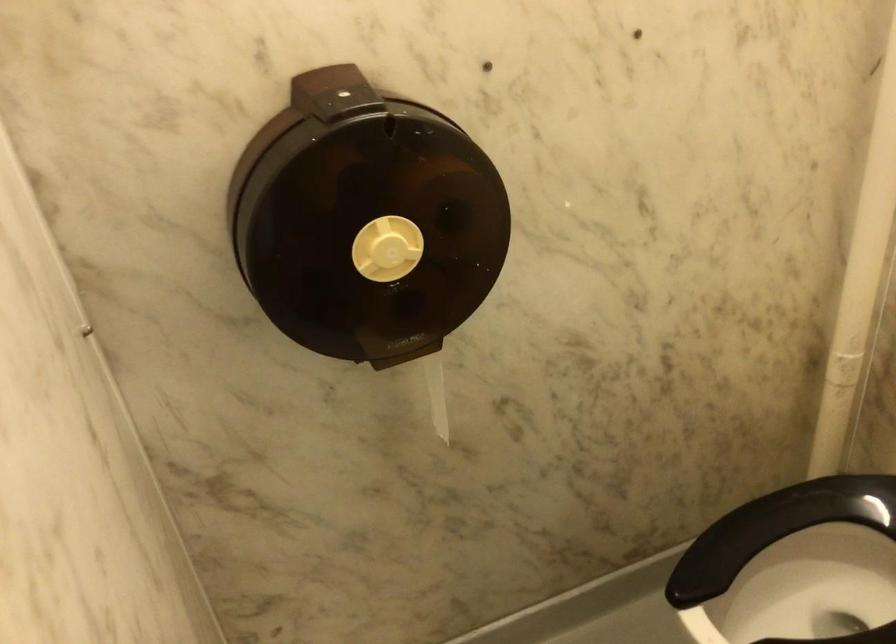
Describe the element at coordinates (435, 393) in the screenshot. I see `the piece of toilet paper` at that location.